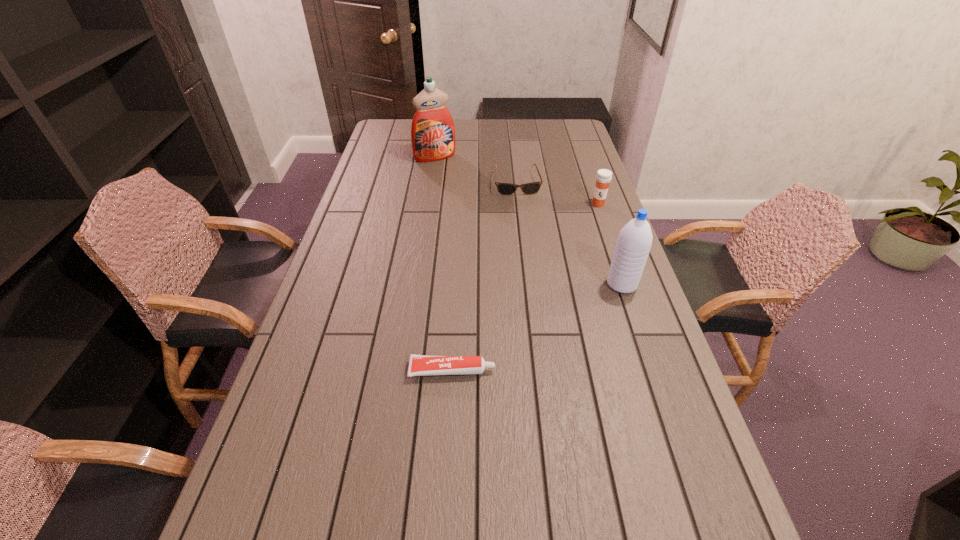
The image size is (960, 540). Find the location of `vacant space on the desktop that is between the toothpaste and the fourth shortest object and is positioned on the lenses of the third object from left to right`. vacant space on the desktop that is between the toothpaste and the fourth shortest object and is positioned on the lenses of the third object from left to right is located at coordinates (544, 323).

What are the coordinates of `free spot on the desktop that is between the shortest object and the water bottle and is positioned on the label side of the third farthest object` in the screenshot? It's located at (567, 312).

At what (x,y) coordinates should I click in order to perform the action: click on free space on the desktop that is between the toothpaste and the fourth farthest object and is positioned on the front surface of the farthest object. Please return your answer as a coordinate pair (x, y). The height and width of the screenshot is (540, 960). Looking at the image, I should click on (551, 320).